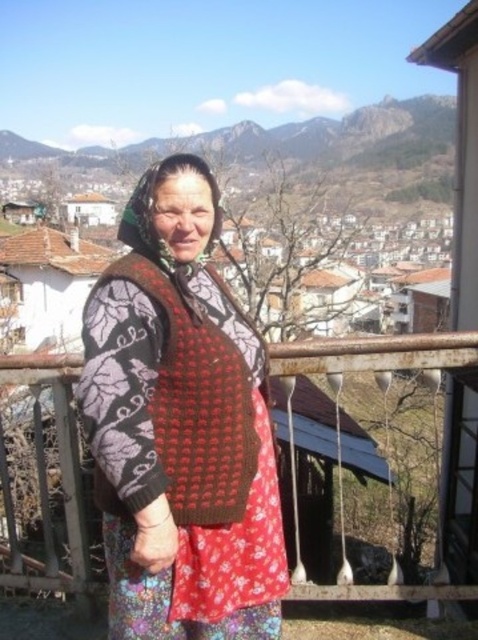
Is knitted sweater at center wider than knitted wool shawl at center?

Yes, knitted sweater at center is wider than knitted wool shawl at center.

Who is shorter, knitted sweater at center or knitted wool shawl at center?

With less height is knitted wool shawl at center.

Identify the location of knitted sweater at center. tap(181, 426).

The height and width of the screenshot is (640, 478). Identify the location of knitted sweater at center. (181, 426).

Does knitted wool shawl at center appear over rusty metal railing at center?

Yes.

Can you confirm if knitted wool shawl at center is smaller than rusty metal railing at center?

Correct, knitted wool shawl at center occupies less space than rusty metal railing at center.

Is point (217, 371) positioned behind point (293, 376)?

That is False.

Find the location of `knitted wool shawl at center`. knitted wool shawl at center is located at coordinates (187, 410).

Looking at this image, does knitted sweater at center have a smaller size compared to green textured mountain at upper center?

Yes.

Between knitted sweater at center and green textured mountain at upper center, which one is positioned higher?

green textured mountain at upper center is higher up.

Who is more distant from viewer, (204, 369) or (106, 170)?

Positioned behind is point (106, 170).

At what (x,y) coordinates should I click in order to perform the action: click on knitted sweater at center. Please return your answer as a coordinate pair (x, y). The width and height of the screenshot is (478, 640). Looking at the image, I should click on (181, 426).